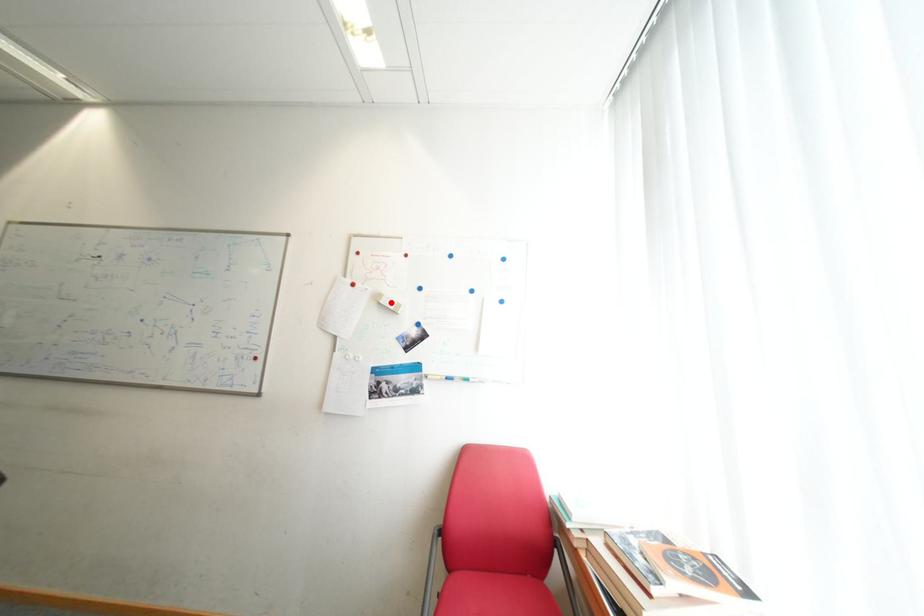
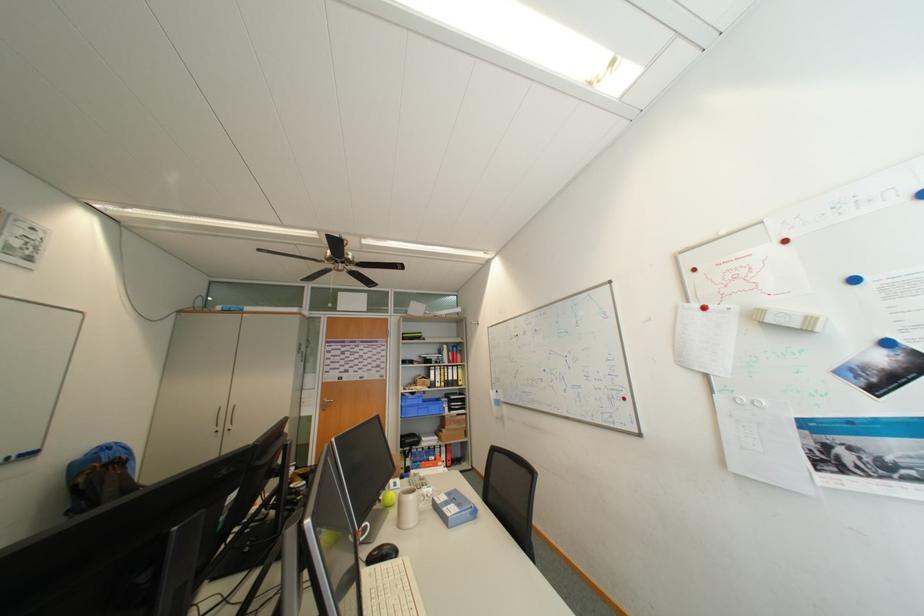
Locate, in the second image, the point that corresponds to the highlighted location in the first image.

(777, 322)